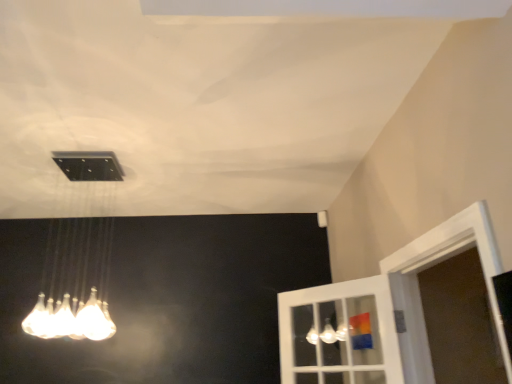
Identify the location of white glossy chandelier at upper left. (75, 281).

What do you see at coordinates (75, 281) in the screenshot? I see `white glossy chandelier at upper left` at bounding box center [75, 281].

Image resolution: width=512 pixels, height=384 pixels. What are the coordinates of `white glossy chandelier at upper left` in the screenshot? It's located at (75, 281).